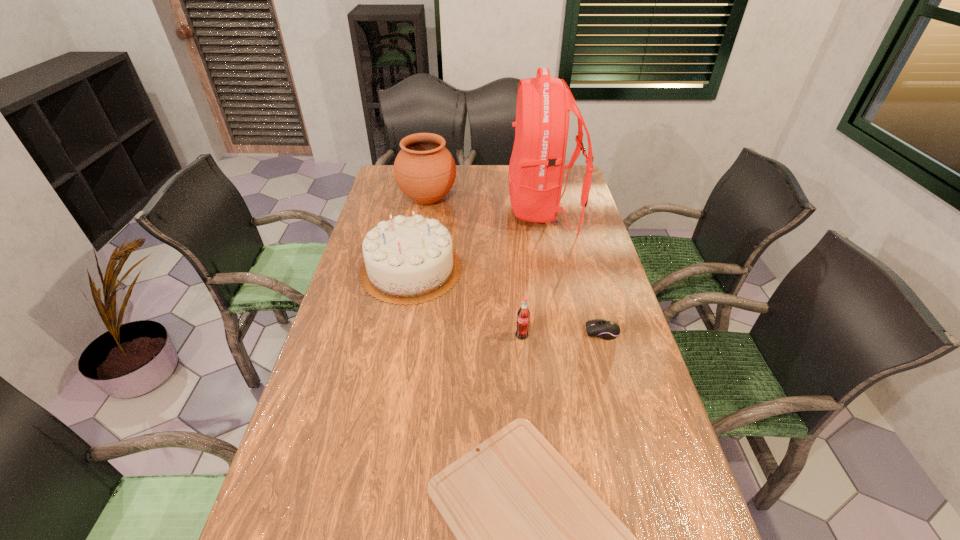
The image size is (960, 540). Find the location of `free space between the pottery and the backpack`. free space between the pottery and the backpack is located at coordinates tap(486, 205).

You are a GUI agent. You are given a task and a screenshot of the screen. Output one action in this format:
    pyautogui.click(x=<x>, y=<y>)
    Task: Click on the blank region between the third tallest object and the backpack
    Image resolution: width=960 pixels, height=540 pixels.
    Given the screenshot: What is the action you would take?
    click(477, 240)

Locate an element on the screen. empty space between the second tallest object and the computer mouse is located at coordinates (515, 266).

I want to click on object that is the third nearest to the chopping board, so click(x=407, y=260).

Locate an element on the screen. The height and width of the screenshot is (540, 960). object that is the fourth closest to the chopping board is located at coordinates coord(537,164).

Image resolution: width=960 pixels, height=540 pixels. Find the location of `vacant space that satisfies the following two spatial constraints: 1. on the back side of the fifth shortest object; 2. on the right side of the third tallest object`. vacant space that satisfies the following two spatial constraints: 1. on the back side of the fifth shortest object; 2. on the right side of the third tallest object is located at coordinates (424, 199).

Identify the location of free space in the image that satisfies the following two spatial constraints: 1. on the main compartment of the tallest object; 2. on the back side of the second shortest object. This screenshot has height=540, width=960. (567, 332).

The width and height of the screenshot is (960, 540). Find the location of `free spot that satisfies the following two spatial constraints: 1. on the main compartment of the tallest object; 2. on the front side of the birthday cake`. free spot that satisfies the following two spatial constraints: 1. on the main compartment of the tallest object; 2. on the front side of the birthday cake is located at coordinates (555, 269).